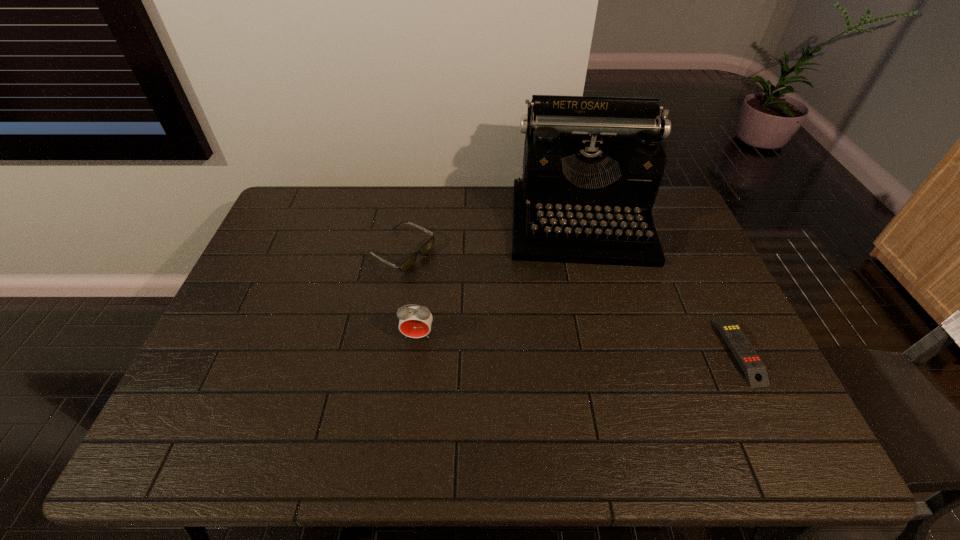
Image resolution: width=960 pixels, height=540 pixels. Find the location of `vacant space on the desktop that is between the alarm clock and the shortest object and is positioned on the front-facing side of the sunglasses`. vacant space on the desktop that is between the alarm clock and the shortest object and is positioned on the front-facing side of the sunglasses is located at coordinates (579, 343).

The image size is (960, 540). In order to click on free space on the desktop that is between the third shortest object and the rightmost object and is positioned on the typing side of the tallest object in this screenshot , I will do `click(598, 344)`.